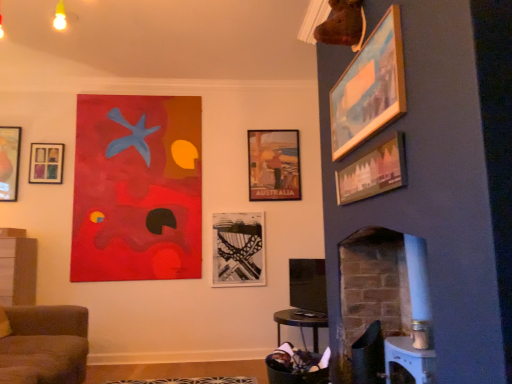
Image resolution: width=512 pixels, height=384 pixels. I want to click on free space above matte paper poster at center, positioned as the 4th picture frame in left-to-right order (from a real-world perspective), so click(x=277, y=120).